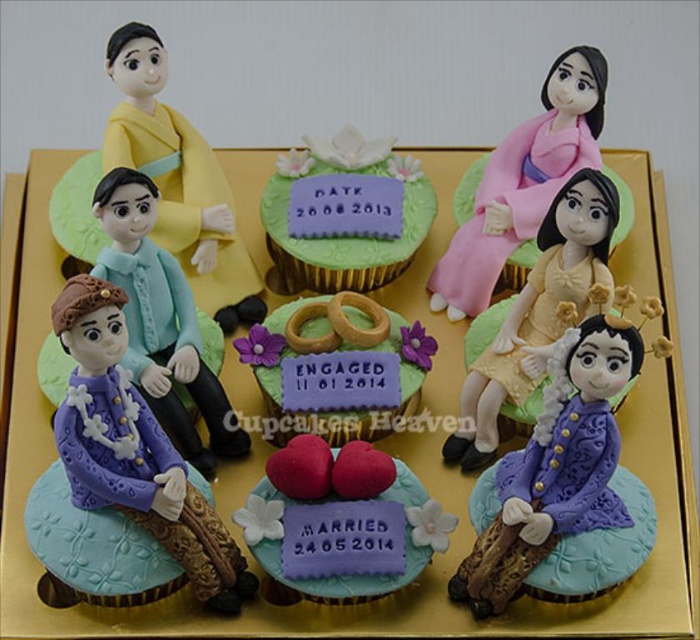
Describe the element at coordinates (336, 365) in the screenshot. This screenshot has height=640, width=700. I see `gold textured rings at center` at that location.

Can you confirm if gold textured rings at center is taller than pink matte kimono at upper center?

Incorrect, gold textured rings at center's height is not larger of pink matte kimono at upper center's.

Does point (274, 429) come in front of point (452, 243)?

Yes, point (274, 429) is in front of point (452, 243).

Where is `gold textured rings at center`? Image resolution: width=700 pixels, height=640 pixels. gold textured rings at center is located at coordinates (336, 365).

Does yellow matte/glossy doll at upper left have a greater width compared to pink matte kimono at upper center?

Correct, the width of yellow matte/glossy doll at upper left exceeds that of pink matte kimono at upper center.

Is point (176, 232) behind point (546, 132)?

That is False.

The image size is (700, 640). Describe the element at coordinates (178, 179) in the screenshot. I see `yellow matte/glossy doll at upper left` at that location.

Where is `yellow matte/glossy doll at upper left`? The image size is (700, 640). yellow matte/glossy doll at upper left is located at coordinates (178, 179).

Is point (71, 458) closer to viewer compared to point (392, 241)?

Yes, point (71, 458) is closer to viewer.

Who is positioned more to the right, purple matte figure at center-left or matte purple fondant cake at center?

Positioned to the right is matte purple fondant cake at center.

Who is more forward, (119,388) or (293,248)?

Positioned in front is point (119,388).

Locate an element on the screen. purple matte figure at center-left is located at coordinates (x=133, y=449).